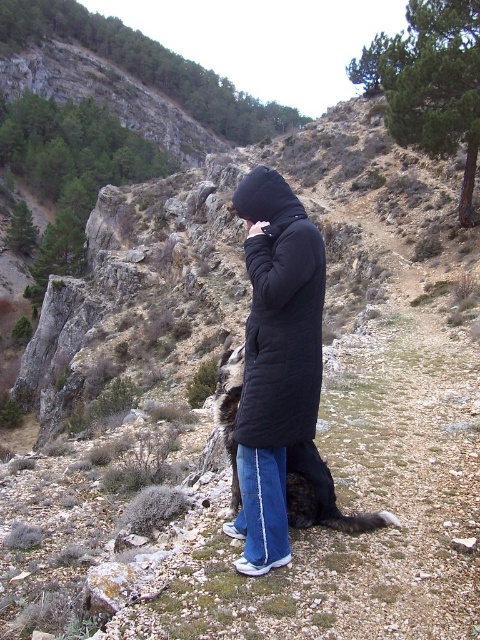
Question: Among these objects, which one is nearest to the camera?

Choices:
 (A) black puffy coat at center
 (B) dark brown fur at center

Answer: (A)

Question: Which point is farther from the camera taking this photo?

Choices:
 (A) (294, 280)
 (B) (362, 532)

Answer: (A)

Question: Is black puffy coat at center closer to camera compared to dark brown fur at center?

Choices:
 (A) yes
 (B) no

Answer: (A)

Question: Is black puffy coat at center to the right of dark brown fur at center from the viewer's perspective?

Choices:
 (A) no
 (B) yes

Answer: (B)

Question: Which point appears farthest from the camera in this image?

Choices:
 (A) (252, 333)
 (B) (327, 474)

Answer: (B)

Question: Is black puffy coat at center positioned in front of dark brown fur at center?

Choices:
 (A) yes
 (B) no

Answer: (A)